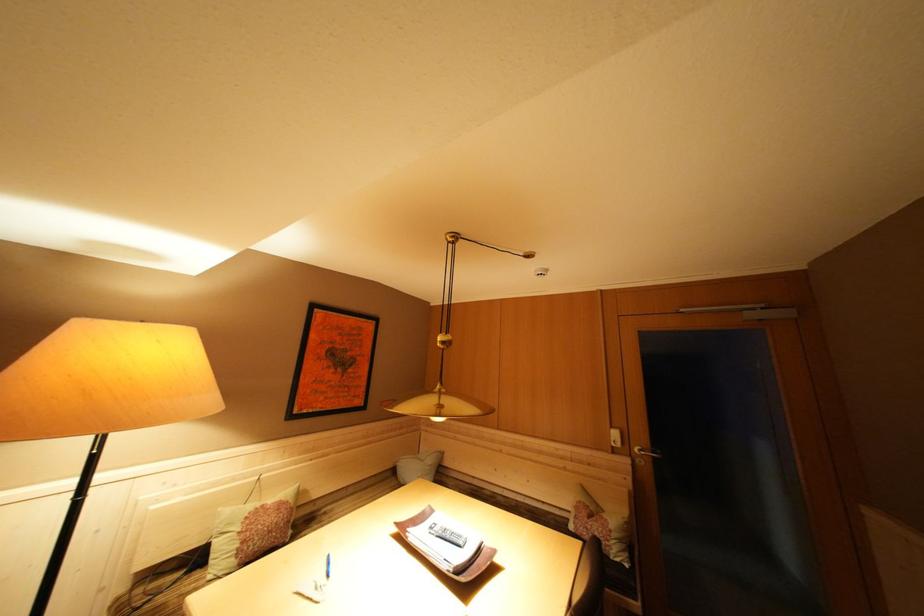
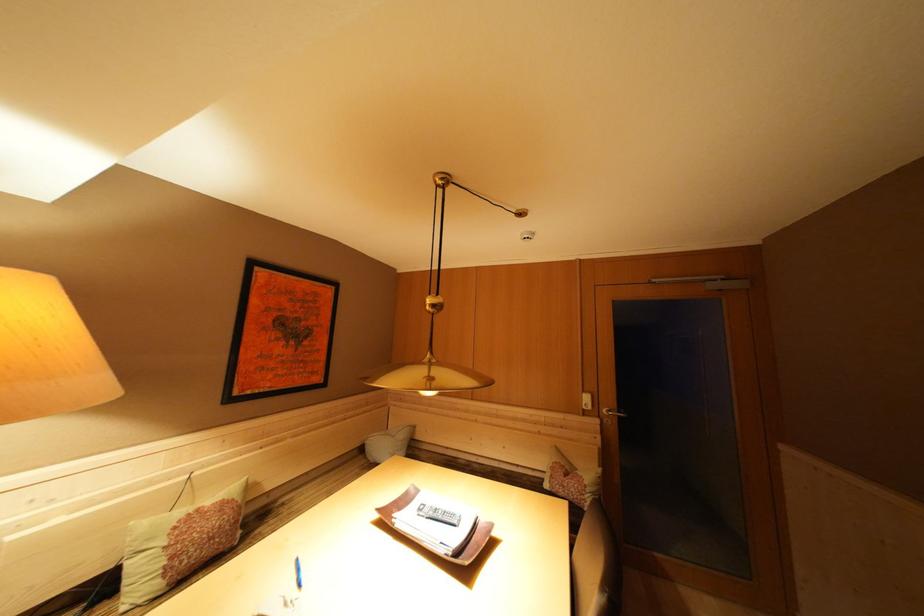
Locate, in the second image, the point that corresponds to [618,432] in the first image.

(590, 397)